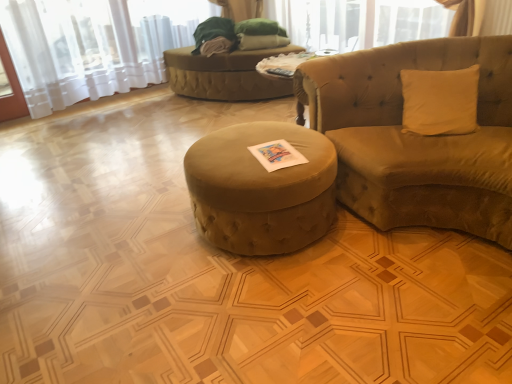
Question: Considering the relative sizes of velvet beige studio couch at right and velvet green bean bag at center in the image provided, is velvet beige studio couch at right taller than velvet green bean bag at center?

Choices:
 (A) no
 (B) yes

Answer: (B)

Question: Considering the relative positions of velvet beige studio couch at right and velvet green bean bag at center in the image provided, is velvet beige studio couch at right to the left of velvet green bean bag at center from the viewer's perspective?

Choices:
 (A) yes
 (B) no

Answer: (B)

Question: Does velvet beige studio couch at right have a greater width compared to velvet green bean bag at center?

Choices:
 (A) yes
 (B) no

Answer: (A)

Question: Considering the relative sizes of velvet beige studio couch at right and velvet green bean bag at center in the image provided, is velvet beige studio couch at right bigger than velvet green bean bag at center?

Choices:
 (A) yes
 (B) no

Answer: (A)

Question: From a real-world perspective, is velvet beige studio couch at right on top of velvet green bean bag at center?

Choices:
 (A) no
 (B) yes

Answer: (B)

Question: Would you say white sheer curtain at upper left is to the left or to the right of velvet beige studio couch at right in the picture?

Choices:
 (A) left
 (B) right

Answer: (A)

Question: From a real-world perspective, relative to velvet beige studio couch at right, is white sheer curtain at upper left vertically above or below?

Choices:
 (A) below
 (B) above

Answer: (B)

Question: From the image's perspective, is white sheer curtain at upper left positioned above or below velvet beige studio couch at right?

Choices:
 (A) above
 (B) below

Answer: (A)

Question: Is white sheer curtain at upper left inside the boundaries of velvet beige studio couch at right, or outside?

Choices:
 (A) outside
 (B) inside

Answer: (A)

Question: Is velvet green bean bag at center taller or shorter than velvet beige studio couch at right?

Choices:
 (A) tall
 (B) short

Answer: (B)

Question: In terms of size, does velvet green bean bag at center appear bigger or smaller than velvet beige studio couch at right?

Choices:
 (A) small
 (B) big

Answer: (A)

Question: In terms of width, does velvet green bean bag at center look wider or thinner when compared to velvet beige studio couch at right?

Choices:
 (A) wide
 (B) thin

Answer: (B)

Question: Considering the positions of point (254, 84) and point (393, 183), is point (254, 84) closer or farther from the camera than point (393, 183)?

Choices:
 (A) closer
 (B) farther

Answer: (B)

Question: From the image's perspective, is velvet green ottoman at center positioned above or below velvet beige studio couch at right?

Choices:
 (A) above
 (B) below

Answer: (B)

Question: Which is correct: velvet green ottoman at center is inside velvet beige studio couch at right, or outside of it?

Choices:
 (A) inside
 (B) outside

Answer: (B)